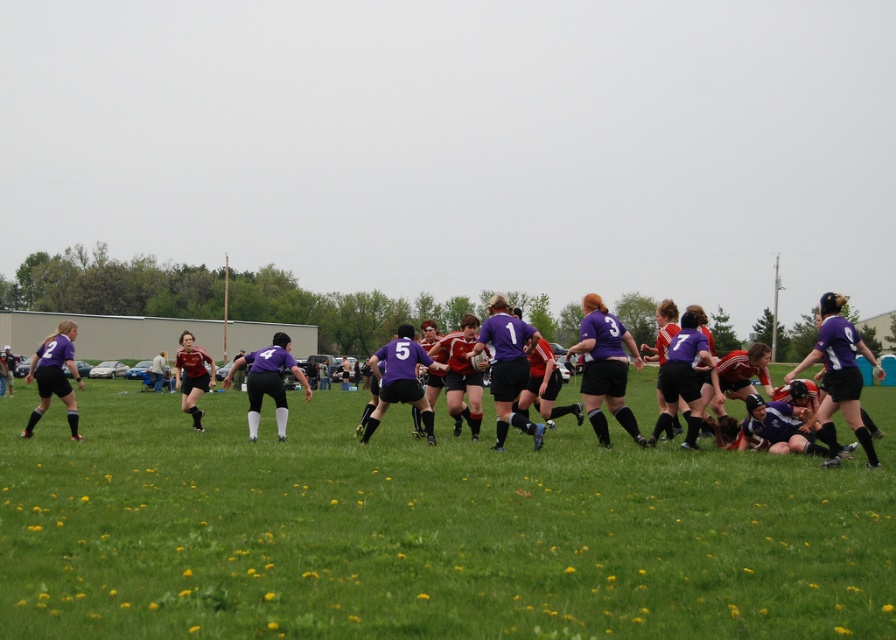
You are a referee observing the rugby match. You notice the green grass at center and the purple matte rugby team at center. Which object is positioned higher in the image?

The green grass at center is located above the purple matte rugby team at center, so it is positioned higher in the image.

You are a photographer trying to capture the rugby team and the grass in the image. If you want to frame the purple matte rugby team at center and the green grass at center in your shot, which object should you place on the left side of your frame?

The purple matte rugby team at center should be placed on the left side of your frame because the green grass at center is positioned on its right side.

You are a photographer trying to capture a photo of the purple matte rugby team at center without the green grass at center blocking the view. Is this possible given their positions?

The green grass at center is in front of the purple matte rugby team at center, so it will block the view. To capture the team without the grass blocking, you need to adjust your angle or position to ensure the grass is behind or beside them.